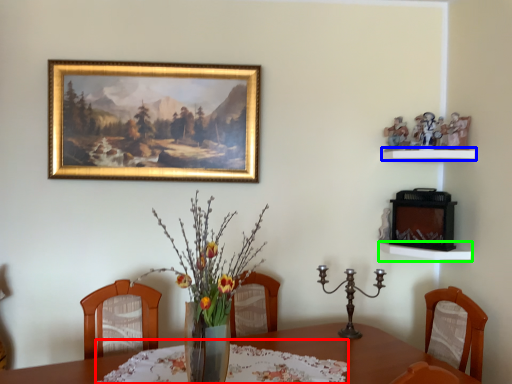
Question: Which object is positioned closest to tablecloth (highlighted by a red box)? Select from shelf (highlighted by a blue box) and shelf (highlighted by a green box).

Choices:
 (A) shelf
 (B) shelf

Answer: (B)